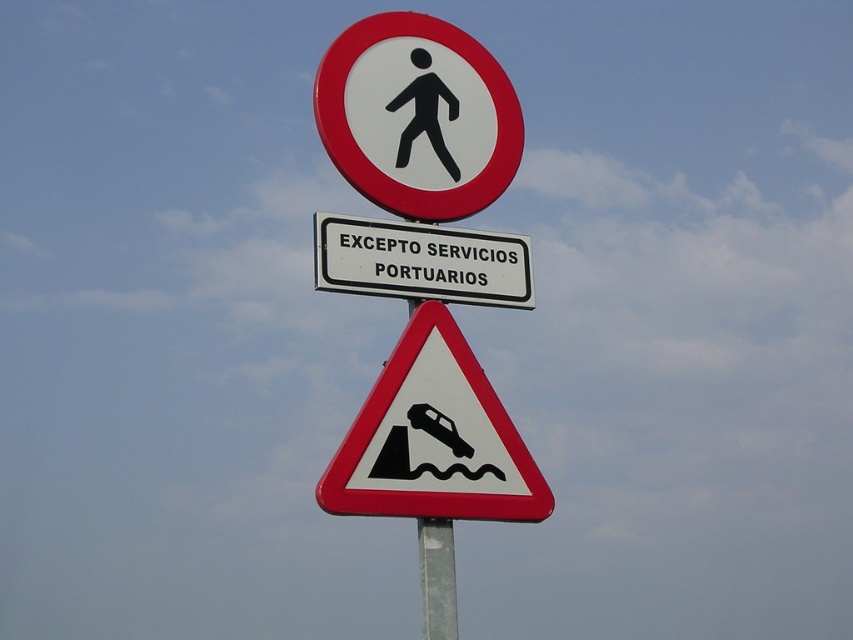
You are a delivery driver approaching the signpost with a vehicle that is not providing port services. You see the white plastic pedestrian at upper center and the black plastic car at center. According to the signs, can you proceed past the signpost?

The white plastic pedestrian at upper center indicates a pedestrian crossing, and the sign below mentions exceptions for port services. Since your vehicle is not providing port services, you must not proceed past the signpost.